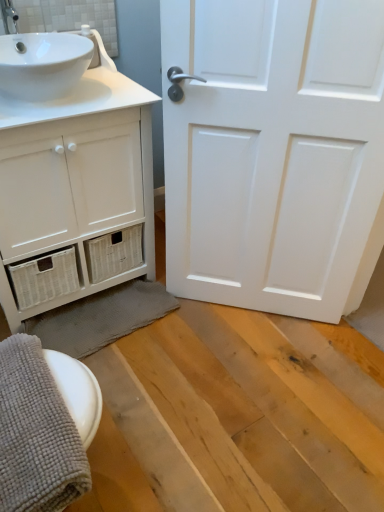
Describe the element at coordinates (36, 434) in the screenshot. I see `gray textured bath towel at lower left, marked as the 2th bath towel in a back-to-front arrangement` at that location.

Measure the distance between gray textured bath towel at lower left, marked as the 2th bath towel in a back-to-front arrangement, and camera.

gray textured bath towel at lower left, marked as the 2th bath towel in a back-to-front arrangement, is 79.60 centimeters from camera.

What do you see at coordinates (75, 191) in the screenshot? I see `white matte cabinet at left` at bounding box center [75, 191].

The width and height of the screenshot is (384, 512). I want to click on gray textured bath towel at lower left, the first bath towel viewed from the back, so click(101, 317).

Is white matte door at center further to camera compared to gray textured bath towel at lower left, marked as the 2th bath towel in a back-to-front arrangement?

Yes.

From the image's perspective, which object appears higher, white matte door at center or gray textured bath towel at lower left, which is the first bath towel in front-to-back order?

white matte door at center.

Can you confirm if white matte door at center is positioned to the left of gray textured bath towel at lower left, which is the first bath towel in front-to-back order?

In fact, white matte door at center is to the right of gray textured bath towel at lower left, which is the first bath towel in front-to-back order.

Who is taller, white matte door at center or gray textured bath towel at lower left, which is the first bath towel in front-to-back order?

Standing taller between the two is white matte door at center.

From the image's perspective, is gray textured bath towel at lower left, the first bath towel viewed from the back, on top of white matte door at center?

Actually, gray textured bath towel at lower left, the first bath towel viewed from the back, appears below white matte door at center in the image.

Is white matte door at center located within gray textured bath towel at lower left, the first bath towel viewed from the back?

No, white matte door at center is not inside gray textured bath towel at lower left, the first bath towel viewed from the back.

How much distance is there between gray textured bath towel at lower left, which is counted as the second bath towel, starting from the front, and white matte door at center?

gray textured bath towel at lower left, which is counted as the second bath towel, starting from the front, is 24.94 inches from white matte door at center.

Consider the image. From a real-world perspective, is gray textured bath towel at lower left, which is counted as the second bath towel, starting from the front, physically below white matte door at center?

Yes, from a real-world perspective, gray textured bath towel at lower left, which is counted as the second bath towel, starting from the front, is below white matte door at center.

Is gray textured bath towel at lower left, which is the first bath towel in front-to-back order, looking in the opposite direction of white glossy sink at upper left?

No.

Locate an element on the screen. the 1st bath towel counting from the right side of the white glossy sink at upper left is located at coordinates (36, 434).

From the image's perspective, is gray textured bath towel at lower left, marked as the 2th bath towel in a back-to-front arrangement, over white glossy sink at upper left?

Actually, gray textured bath towel at lower left, marked as the 2th bath towel in a back-to-front arrangement, appears below white glossy sink at upper left in the image.

Considering the points (360, 115) and (117, 286), which point is in front, point (360, 115) or point (117, 286)?

The point (360, 115) is closer.

From a real-world perspective, is white matte door at center physically below gray textured bath towel at lower left, the first bath towel viewed from the back?

No, from a real-world perspective, white matte door at center is not under gray textured bath towel at lower left, the first bath towel viewed from the back.

From the image's perspective, is white matte door at center over gray textured bath towel at lower left, the first bath towel viewed from the back?

Yes, from the image's perspective, white matte door at center is above gray textured bath towel at lower left, the first bath towel viewed from the back.

Considering the relative sizes of white matte door at center and gray textured bath towel at lower left, which is counted as the second bath towel, starting from the front, in the image provided, is white matte door at center shorter than gray textured bath towel at lower left, which is counted as the second bath towel, starting from the front,?

Incorrect, the height of white matte door at center does not fall short of that of gray textured bath towel at lower left, which is counted as the second bath towel, starting from the front.

How different are the orientations of white matte door at center and white glossy sink at upper left in degrees?

The angle between the facing direction of white matte door at center and the facing direction of white glossy sink at upper left is 42.3 degrees.

Is white matte door at center thinner than white glossy sink at upper left?

Yes.

Looking at this image, in the image, is white matte door at center positioned in front of or behind white glossy sink at upper left?

white matte door at center is positioned closer to the viewer than white glossy sink at upper left.

Is white matte cabinet at left not close to gray textured bath towel at lower left, marked as the 2th bath towel in a back-to-front arrangement?

No, white matte cabinet at left is not far from gray textured bath towel at lower left, marked as the 2th bath towel in a back-to-front arrangement.

From the image's perspective, is white matte cabinet at left positioned above or below gray textured bath towel at lower left, marked as the 2th bath towel in a back-to-front arrangement?

From the image's perspective, white matte cabinet at left appears above gray textured bath towel at lower left, marked as the 2th bath towel in a back-to-front arrangement.

Would you say white matte cabinet at left is to the left or to the right of gray textured bath towel at lower left, marked as the 2th bath towel in a back-to-front arrangement, in the picture?

In the image, white matte cabinet at left appears on the left side of gray textured bath towel at lower left, marked as the 2th bath towel in a back-to-front arrangement.

Does white matte cabinet at left have a lesser height compared to gray textured bath towel at lower left, which is the first bath towel in front-to-back order?

In fact, white matte cabinet at left may be taller than gray textured bath towel at lower left, which is the first bath towel in front-to-back order.

Does gray textured bath towel at lower left, which is counted as the second bath towel, starting from the front, have a greater height compared to white glossy sink at upper left?

In fact, gray textured bath towel at lower left, which is counted as the second bath towel, starting from the front, may be shorter than white glossy sink at upper left.

How different are the orientations of gray textured bath towel at lower left, the first bath towel viewed from the back, and white glossy sink at upper left in degrees?

The facing directions of gray textured bath towel at lower left, the first bath towel viewed from the back, and white glossy sink at upper left are 3.18 degrees apart.

Looking at this image, in the image, is gray textured bath towel at lower left, which is counted as the second bath towel, starting from the front, positioned in front of or behind white glossy sink at upper left?

gray textured bath towel at lower left, which is counted as the second bath towel, starting from the front, is behind white glossy sink at upper left.

From a real-world perspective, is gray textured bath towel at lower left, which is counted as the second bath towel, starting from the front, above or below white glossy sink at upper left?

gray textured bath towel at lower left, which is counted as the second bath towel, starting from the front, is below white glossy sink at upper left.

Locate an element on the screen. door above the gray textured bath towel at lower left, which is the first bath towel in front-to-back order (from a real-world perspective) is located at coordinates (274, 152).

From a real-world perspective, starting from the white matte door at center, which bath towel is the 2nd one below it? Please provide its 2D coordinates.

[(101, 317)]

When comparing their distances from white matte cabinet at left, does white glossy sink at upper left or gray textured bath towel at lower left, marked as the 2th bath towel in a back-to-front arrangement, seem closer?

white glossy sink at upper left lies closer to white matte cabinet at left than the other object.

Which object lies further to the anchor point gray textured bath towel at lower left, marked as the 2th bath towel in a back-to-front arrangement, white glossy sink at upper left or gray textured bath towel at lower left, the first bath towel viewed from the back?

The object further to gray textured bath towel at lower left, marked as the 2th bath towel in a back-to-front arrangement, is white glossy sink at upper left.

From the image, which object appears to be nearer to white matte cabinet at left, white matte door at center or gray textured bath towel at lower left, which is the first bath towel in front-to-back order?

white matte door at center is closer to white matte cabinet at left.

Estimate the real-world distances between objects in this image. Which object is closer to gray textured bath towel at lower left, the first bath towel viewed from the back, white matte cabinet at left or gray textured bath towel at lower left, marked as the 2th bath towel in a back-to-front arrangement?

Based on the image, white matte cabinet at left appears to be nearer to gray textured bath towel at lower left, the first bath towel viewed from the back.

Which object lies nearer to the anchor point white matte door at center, white glossy sink at upper left or gray textured bath towel at lower left, which is counted as the second bath towel, starting from the front?

Based on the image, white glossy sink at upper left appears to be nearer to white matte door at center.

Estimate the real-world distances between objects in this image. Which object is further from gray textured bath towel at lower left, which is counted as the second bath towel, starting from the front, gray textured bath towel at lower left, which is the first bath towel in front-to-back order, or white matte door at center?

Based on the image, gray textured bath towel at lower left, which is the first bath towel in front-to-back order, appears to be further to gray textured bath towel at lower left, which is counted as the second bath towel, starting from the front.

From the image, which object appears to be nearer to gray textured bath towel at lower left, which is the first bath towel in front-to-back order, white matte door at center or white matte cabinet at left?

white matte cabinet at left is closer to gray textured bath towel at lower left, which is the first bath towel in front-to-back order.

Looking at the image, which one is located further to white matte door at center, gray textured bath towel at lower left, which is counted as the second bath towel, starting from the front, or gray textured bath towel at lower left, marked as the 2th bath towel in a back-to-front arrangement?

gray textured bath towel at lower left, marked as the 2th bath towel in a back-to-front arrangement, lies further to white matte door at center than the other object.

The height and width of the screenshot is (512, 384). I want to click on bathroom cabinet positioned between gray textured bath towel at lower left, marked as the 2th bath towel in a back-to-front arrangement, and gray textured bath towel at lower left, which is counted as the second bath towel, starting from the front, from near to far, so [75, 191].

Where is `door between white glossy sink at upper left and gray textured bath towel at lower left, the first bath towel viewed from the back, vertically`? Image resolution: width=384 pixels, height=512 pixels. door between white glossy sink at upper left and gray textured bath towel at lower left, the first bath towel viewed from the back, vertically is located at coordinates (274, 152).

Locate an element on the screen. This screenshot has height=512, width=384. counter top between white matte cabinet at left and white matte door at center in the horizontal direction is located at coordinates (80, 96).

At what (x,y) coordinates should I click in order to perform the action: click on door positioned between gray textured bath towel at lower left, which is the first bath towel in front-to-back order, and gray textured bath towel at lower left, which is counted as the second bath towel, starting from the front, from near to far. Please return your answer as a coordinate pair (x, y). This screenshot has height=512, width=384. Looking at the image, I should click on (274, 152).